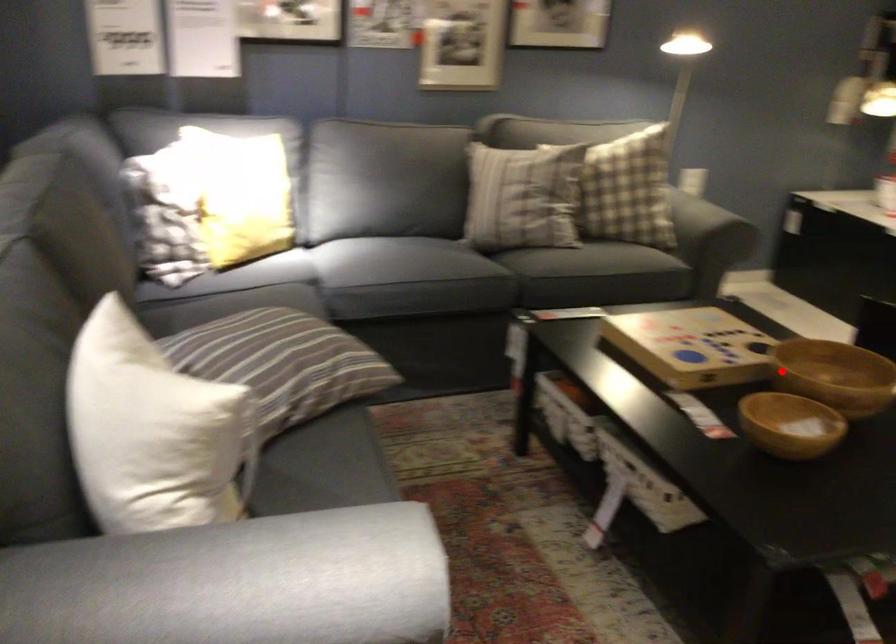
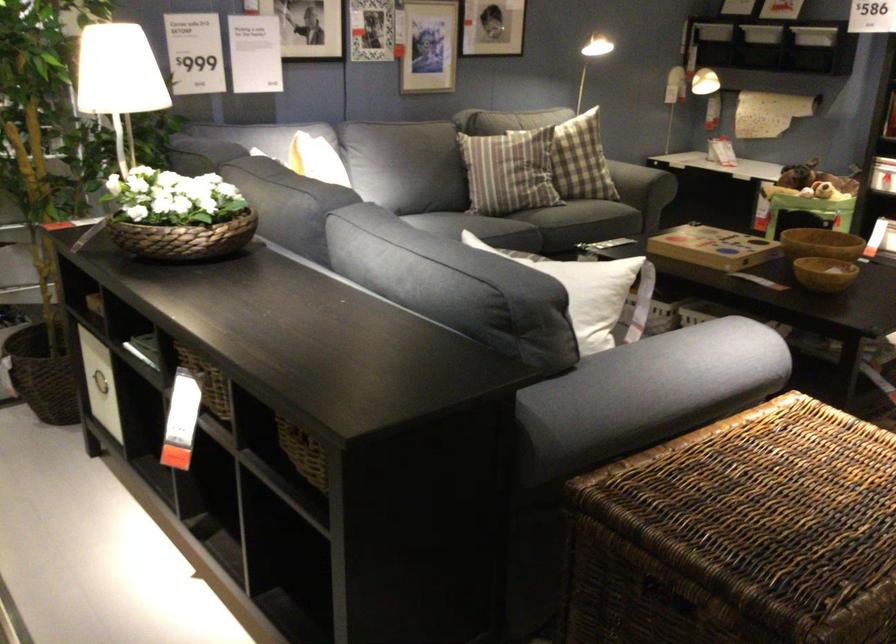
Question: A red point is marked in image1. In image2, is the corresponding 3D point closer to the camera or farther? Reply with the corresponding letter.

Choices:
 (A) The corresponding 3D point is closer.
 (B) The corresponding 3D point is farther.

Answer: (B)